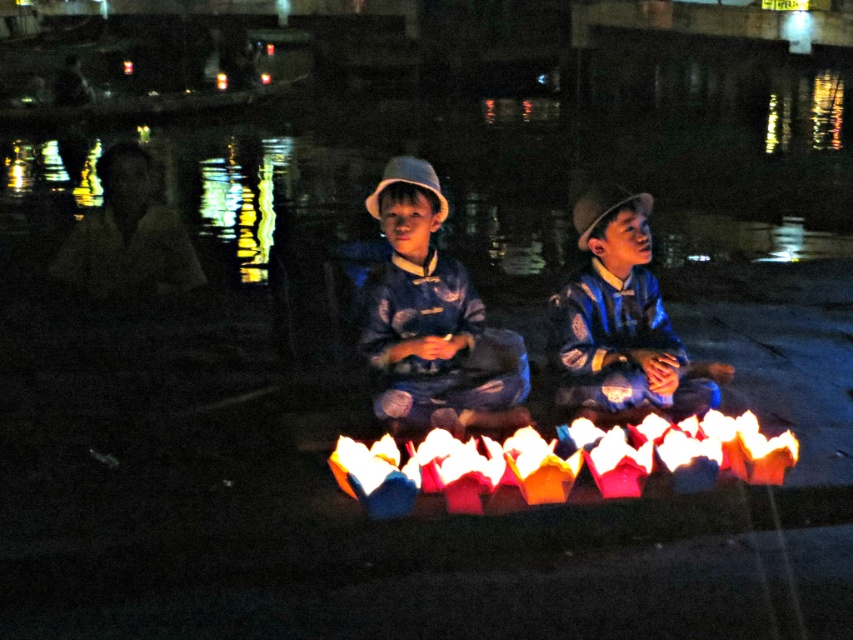
You are a photographer trying to capture the children and their lanterns in the nighttime scene. You notice two blue items at the center of the image. Which one is taller between the matte blue fabric at center and the blue striped shirt at center?

The matte blue fabric at center is taller than the blue striped shirt at center according to the description.

You are a photographer trying to capture the two children holding lanterns. You want to ensure the matte blue fabric at center and the blue striped shirt at center are both visible in your shot. Which object should you position closer to the left side of the frame to include both?

The matte blue fabric at center is to the left of blue striped shirt at center, so positioning the matte blue fabric at center closer to the left side of the frame will ensure both objects are visible.

You are a photographer trying to capture the children and their lanterns in the scene. Since the matte blue fabric at center and the multicolored paper lanterns at center are both at the center, which object will be more in the foreground?

The matte blue fabric at center is much taller as multicolored paper lanterns at center, so the matte blue fabric at center will be more in the foreground.